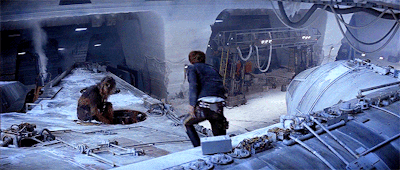
The image size is (400, 170). Find the location of `lights`. lights is located at coordinates (23, 50), (64, 49), (82, 29), (97, 44).